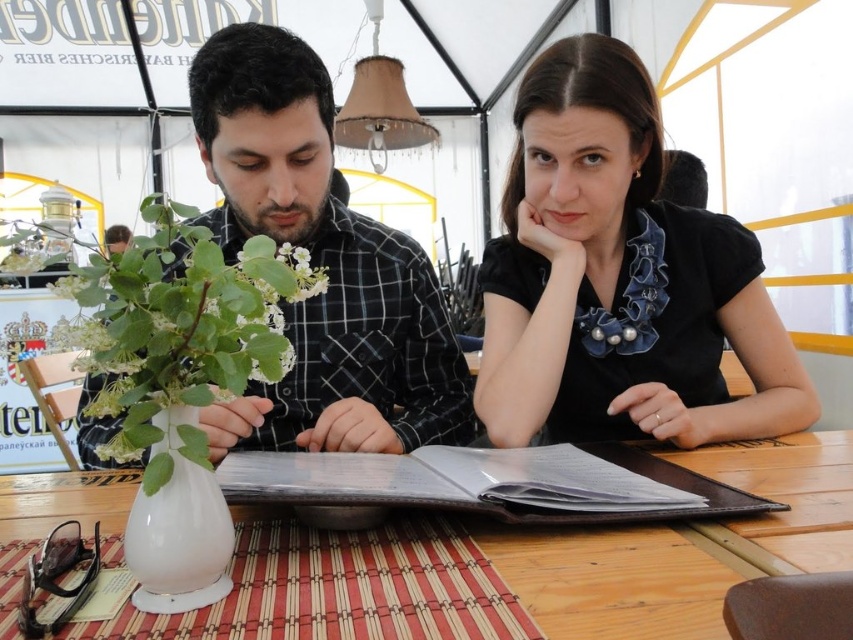
Does black satin blouse at center appear under wooden table at center?

No, black satin blouse at center is not below wooden table at center.

Does black satin blouse at center have a lesser height compared to wooden table at center?

No, black satin blouse at center is not shorter than wooden table at center.

What are the coordinates of `black satin blouse at center` in the screenshot? It's located at (619, 278).

Does white matte flower at center have a larger size compared to white glossy vase at lower left?

Correct, white matte flower at center is larger in size than white glossy vase at lower left.

Is point (165, 262) in front of point (210, 509)?

No, (165, 262) is behind (210, 509).

Locate an element on the screen. This screenshot has width=853, height=640. white matte flower at center is located at coordinates (183, 323).

Does point (518, 556) come farther from viewer compared to point (136, 545)?

Yes, point (518, 556) is behind point (136, 545).

Locate an element on the screen. The height and width of the screenshot is (640, 853). wooden table at center is located at coordinates (682, 545).

Find the location of a particular element. This screenshot has width=853, height=640. wooden table at center is located at coordinates pos(682,545).

Where is `wooden table at center`? The width and height of the screenshot is (853, 640). wooden table at center is located at coordinates (682, 545).